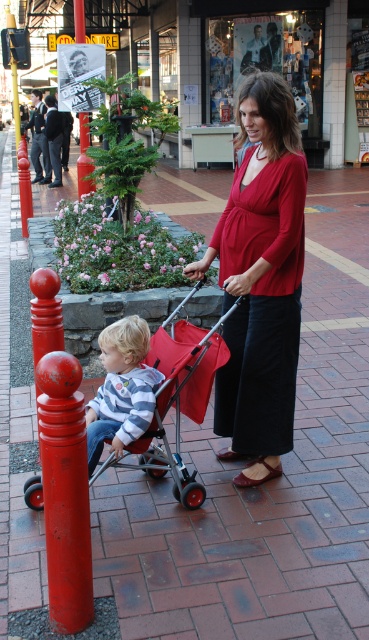
Between matte red stroller at center and striped cotton shirt at center, which one appears on the left side from the viewer's perspective?

striped cotton shirt at center is more to the left.

Who is higher up, matte red stroller at center or striped cotton shirt at center?

matte red stroller at center is higher up.

Where is `matte red stroller at center`? matte red stroller at center is located at coordinates (181, 396).

You are a GUI agent. You are given a task and a screenshot of the screen. Output one action in this format:
    pyautogui.click(x=<x>, y=<y>)
    Task: Click on the matte red stroller at center
    The width and height of the screenshot is (369, 640).
    Given the screenshot: What is the action you would take?
    pyautogui.click(x=181, y=396)

Does matte red stroller at center have a lesser height compared to metallic red pole at left?

Correct, matte red stroller at center is not as tall as metallic red pole at left.

Does matte red stroller at center have a greater width compared to metallic red pole at left?

In fact, matte red stroller at center might be narrower than metallic red pole at left.

Consider the image. Who is more forward, (164, 448) or (81, 173)?

Positioned in front is point (164, 448).

The image size is (369, 640). I want to click on matte red stroller at center, so click(181, 396).

Looking at this image, which of these two, matte red blouse at center or matte red stroller at center, stands taller?

matte red blouse at center

Can you confirm if matte red blouse at center is thinner than matte red stroller at center?

Yes, matte red blouse at center is thinner than matte red stroller at center.

Is point (229, 234) farther from camera compared to point (215, 362)?

Yes, it is.

At what (x,y) coordinates should I click in order to perform the action: click on matte red blouse at center. Please return your answer as a coordinate pair (x, y). The width and height of the screenshot is (369, 640). Looking at the image, I should click on (260, 280).